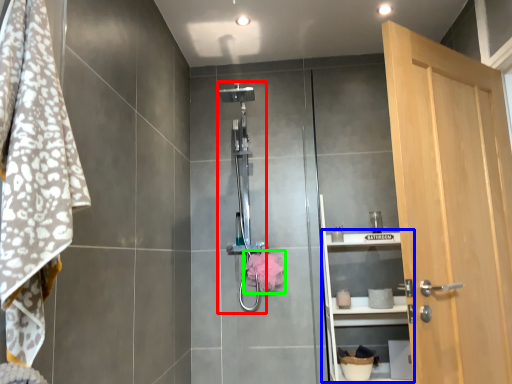
Question: Which object is positioned closest to shower (highlighted by a red box)? Select from shelf (highlighted by a blue box) and hand towel (highlighted by a green box).

Choices:
 (A) shelf
 (B) hand towel

Answer: (B)